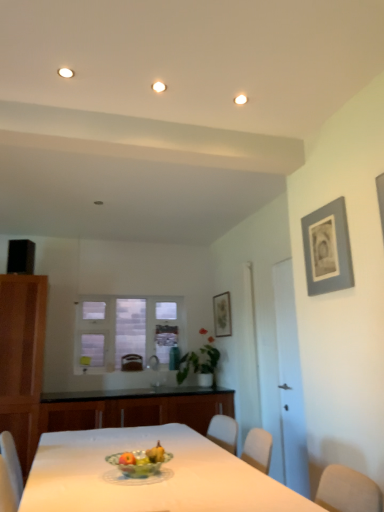
Question: Is white glossy door at right looking in the opposite direction of gray matte picture frame at upper right, which is counted as the 2th picture frame, starting from the bottom?

Choices:
 (A) no
 (B) yes

Answer: (A)

Question: From the image's perspective, is white glossy door at right located beneath gray matte picture frame at upper right, the 1th picture frame in the right-to-left sequence?

Choices:
 (A) no
 (B) yes

Answer: (B)

Question: Considering the relative sizes of white glossy door at right and gray matte picture frame at upper right, which is counted as the 2th picture frame, starting from the bottom, in the image provided, is white glossy door at right shorter than gray matte picture frame at upper right, which is counted as the 2th picture frame, starting from the bottom,?

Choices:
 (A) no
 (B) yes

Answer: (A)

Question: Considering the relative sizes of white glossy door at right and gray matte picture frame at upper right, the 1th picture frame when ordered from front to back, in the image provided, is white glossy door at right smaller than gray matte picture frame at upper right, the 1th picture frame when ordered from front to back,?

Choices:
 (A) yes
 (B) no

Answer: (B)

Question: Would you say white glossy door at right contains gray matte picture frame at upper right, the first picture frame from the top?

Choices:
 (A) no
 (B) yes

Answer: (A)

Question: Does white glossy door at right have a greater width compared to gray matte picture frame at upper right, which is counted as the second picture frame, starting from the back?

Choices:
 (A) no
 (B) yes

Answer: (B)

Question: Is brown leather armchair at center a part of black granite countertop at center?

Choices:
 (A) yes
 (B) no

Answer: (B)

Question: Considering the relative sizes of black granite countertop at center and brown leather armchair at center in the image provided, is black granite countertop at center thinner than brown leather armchair at center?

Choices:
 (A) no
 (B) yes

Answer: (A)

Question: From the image's perspective, would you say black granite countertop at center is shown under brown leather armchair at center?

Choices:
 (A) yes
 (B) no

Answer: (A)

Question: Is black granite countertop at center at the left side of brown leather armchair at center?

Choices:
 (A) no
 (B) yes

Answer: (A)

Question: From a real-world perspective, is black granite countertop at center physically below brown leather armchair at center?

Choices:
 (A) no
 (B) yes

Answer: (B)

Question: Would you say black granite countertop at center is a long distance from brown leather armchair at center?

Choices:
 (A) no
 (B) yes

Answer: (B)

Question: Does white glass window at center lie in front of matte gray picture frame at upper center, acting as the first picture frame starting from the left?

Choices:
 (A) no
 (B) yes

Answer: (A)